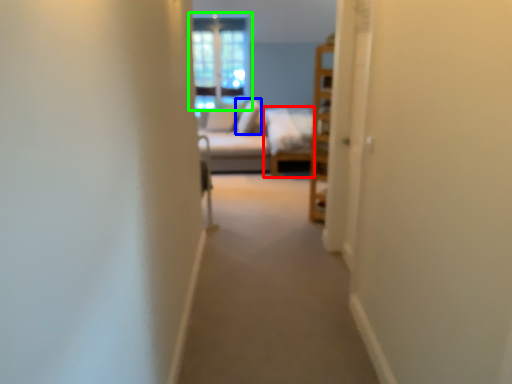
Question: Which object is the closest to the couch (highlighted by a red box)? Choose among these: pillow (highlighted by a blue box) or window (highlighted by a green box).

Choices:
 (A) pillow
 (B) window

Answer: (A)